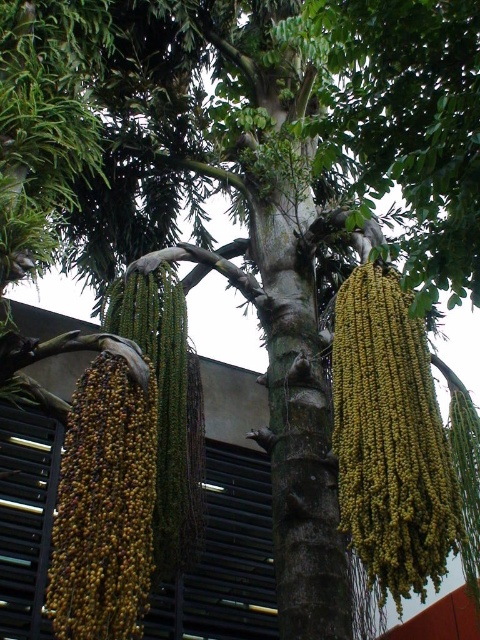
Is yellow-green textured cluster at right bigger than green matte palm fruit at left?

Indeed, yellow-green textured cluster at right has a larger size compared to green matte palm fruit at left.

Who is more forward, (417, 540) or (156, 435)?

Point (417, 540) is in front.

Does point (459, 520) lie in front of point (124, 451)?

No, (459, 520) is further to viewer.

You are a GUI agent. You are given a task and a screenshot of the screen. Output one action in this format:
    pyautogui.click(x=<x>, y=<y>)
    Task: Click on the yellow-green textured cluster at right
    
    Given the screenshot: What is the action you would take?
    pyautogui.click(x=391, y=440)